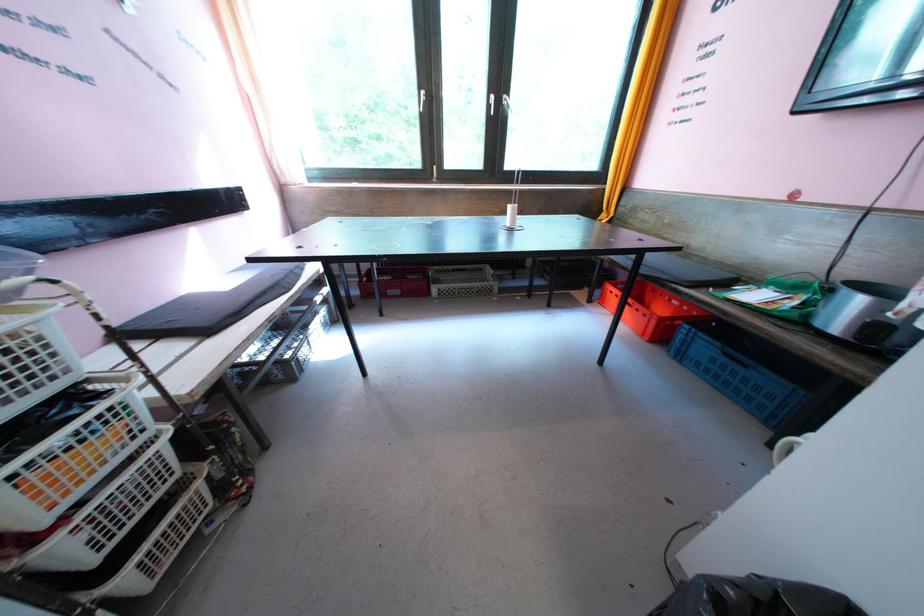
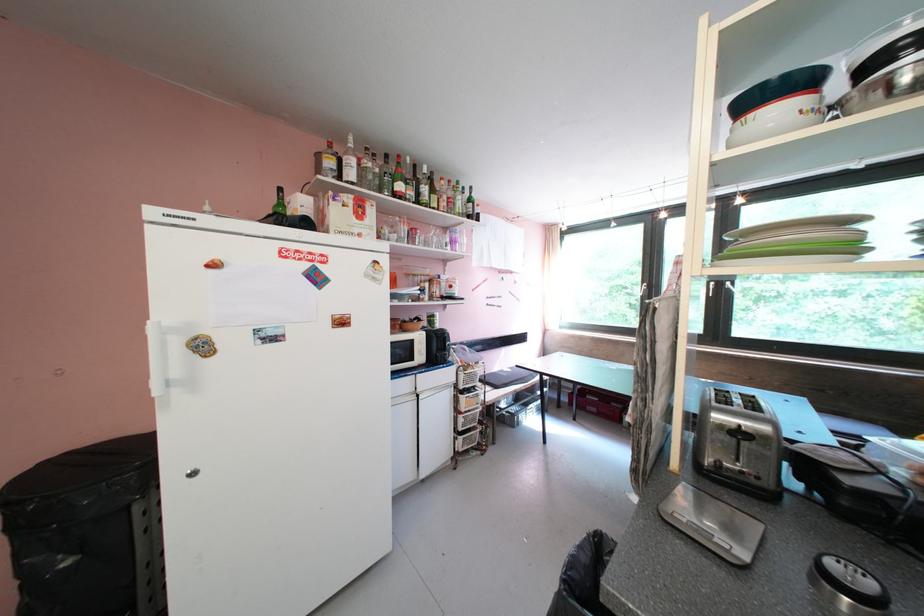
The point at (111, 397) is marked in the first image. Where is the corresponding point in the second image?

(485, 392)